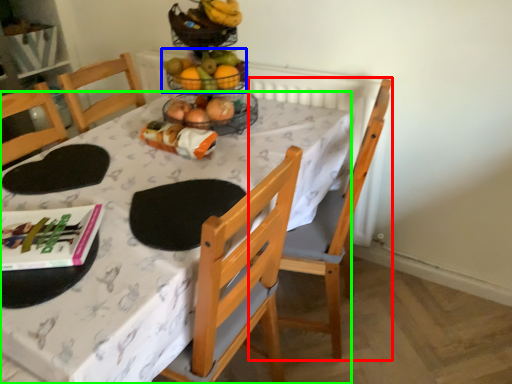
Question: Which is farther away from chair (highlighted by a red box)? grapefruit (highlighted by a blue box) or desk (highlighted by a green box)?

Choices:
 (A) grapefruit
 (B) desk

Answer: (A)